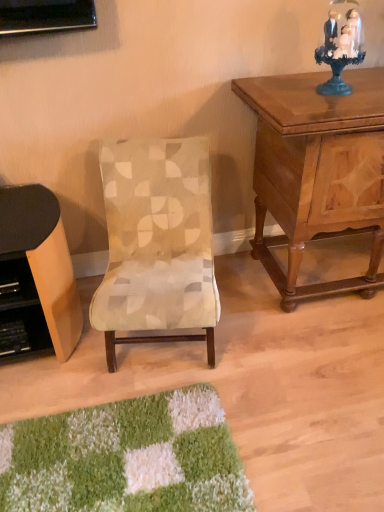
I want to click on vacant space that's between wooden nightstand at upper right and beige fabric chair at center, so click(265, 323).